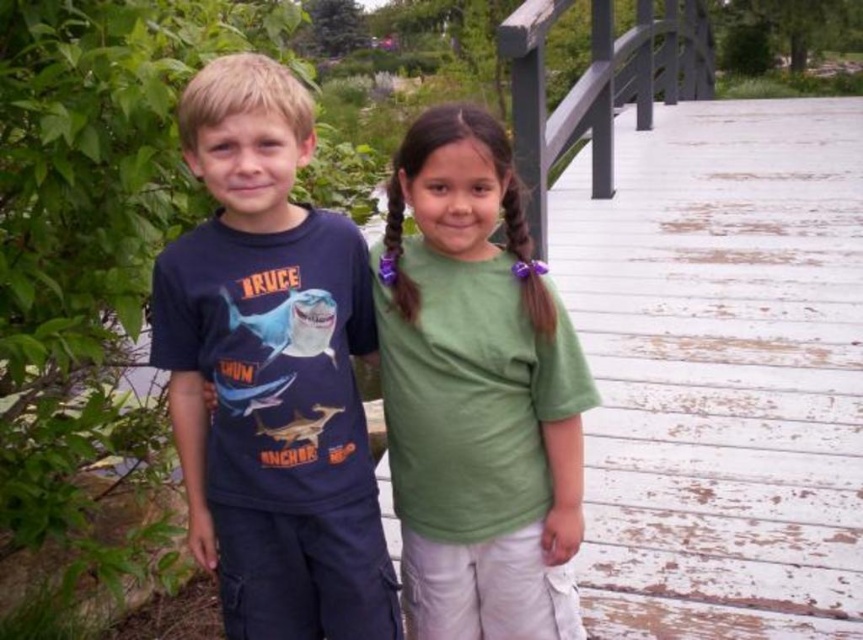
Measure the distance between point (819, 616) and camera.

Point (819, 616) is 2.35 meters from camera.

Does white weathered wood at right appear on the left side of matte blue t-shirt at left?

In fact, white weathered wood at right is to the right of matte blue t-shirt at left.

Measure the distance between white weathered wood at right and camera.

white weathered wood at right is 5.67 meters from camera.

Identify the location of white weathered wood at right. (721, 371).

Between point (300, 486) and point (527, 61), which one is positioned behind?

Positioned behind is point (527, 61).

Is matte blue t-shirt at left wider than wooden balustrade at upper right?

Incorrect, matte blue t-shirt at left's width does not surpass wooden balustrade at upper right's.

Locate an element on the screen. matte blue t-shirt at left is located at coordinates (271, 371).

The width and height of the screenshot is (863, 640). Identify the location of matte blue t-shirt at left. (x=271, y=371).

Does white weathered wood at right have a smaller size compared to wooden balustrade at upper right?

Yes, white weathered wood at right is smaller than wooden balustrade at upper right.

Can you confirm if white weathered wood at right is positioned below wooden balustrade at upper right?

Yes.

Does point (690, 282) lie behind point (710, 33)?

No, it is not.

Locate an element on the screen. white weathered wood at right is located at coordinates (721, 371).